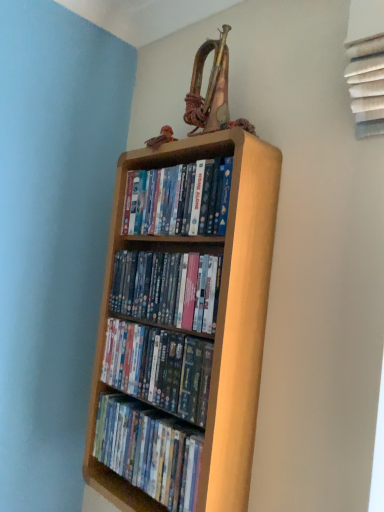
This screenshot has height=512, width=384. I want to click on wooden shelf at center, the 3th book positioned from the bottom, so click(x=167, y=288).

Considering the positions of points (203, 356) and (124, 300), is point (203, 356) closer to camera compared to point (124, 300)?

Yes, it is in front of point (124, 300).

Between matte plastic dvds at center, acting as the second book starting from the bottom, and wooden shelf at center, the 3th book positioned from the bottom, which one has more height?

matte plastic dvds at center, acting as the second book starting from the bottom.

Which of these two, matte plastic dvds at center, acting as the second book starting from the bottom, or wooden shelf at center, arranged as the second book when viewed from the top, is bigger?

matte plastic dvds at center, acting as the second book starting from the bottom.

From the image's perspective, is matte plastic dvds at center, positioned as the third book in top-to-bottom order, located above wooden shelf at center, arranged as the second book when viewed from the top?

No, from the image's perspective, matte plastic dvds at center, positioned as the third book in top-to-bottom order, is not above wooden shelf at center, arranged as the second book when viewed from the top.

Is light wood bookcase at center further to the viewer compared to wooden shelf at center, the 3th book positioned from the bottom?

No, light wood bookcase at center is closer to the camera.

From a real-world perspective, relative to wooden shelf at center, the 3th book positioned from the bottom, is light wood bookcase at center vertically above or below?

light wood bookcase at center is below wooden shelf at center, the 3th book positioned from the bottom.

From the picture: Which point is more forward, (215, 475) or (121, 300)?

The point (215, 475) is more forward.

Would you say light wood bookcase at center is inside or outside wooden shelf at center, arranged as the second book when viewed from the top?

The correct answer is: outside.

From the image's perspective, who appears lower, light wood bookcase at center or matte wooden shelf at upper center, the first book viewed from the top?

light wood bookcase at center is shown below in the image.

Is light wood bookcase at center positioned far away from matte wooden shelf at upper center, acting as the fourth book starting from the bottom?

light wood bookcase at center is actually quite close to matte wooden shelf at upper center, acting as the fourth book starting from the bottom.

From the picture: Is light wood bookcase at center in front of matte wooden shelf at upper center, the first book viewed from the top?

Yes, light wood bookcase at center is in front of matte wooden shelf at upper center, the first book viewed from the top.

From a real-world perspective, which object rests below the other?

light wood bookcase at center is physically lower.

Considering the sizes of objects matte wooden shelf at upper center, the first book viewed from the top, and wooden shelf at center, the 4th book in the top-to-bottom sequence, in the image provided, who is smaller, matte wooden shelf at upper center, the first book viewed from the top, or wooden shelf at center, the 4th book in the top-to-bottom sequence,?

Smaller between the two is matte wooden shelf at upper center, the first book viewed from the top.

Which object is further away from the camera, matte wooden shelf at upper center, the first book viewed from the top, or wooden shelf at center, the first book when ordered from bottom to top?

matte wooden shelf at upper center, the first book viewed from the top, is behind.

Is matte wooden shelf at upper center, the first book viewed from the top, next to wooden shelf at center, the first book when ordered from bottom to top?

matte wooden shelf at upper center, the first book viewed from the top, and wooden shelf at center, the first book when ordered from bottom to top, are clearly separated.

From the image's perspective, is matte plastic dvds at center, positioned as the third book in top-to-bottom order, below wooden shelf at center, the 4th book in the top-to-bottom sequence?

No.

Which of these two, matte plastic dvds at center, acting as the second book starting from the bottom, or wooden shelf at center, the 4th book in the top-to-bottom sequence, stands shorter?

Standing shorter between the two is matte plastic dvds at center, acting as the second book starting from the bottom.

Considering the positions of points (163, 351) and (200, 440), is point (163, 351) farther from camera compared to point (200, 440)?

Yes, point (163, 351) is behind point (200, 440).

Which object is wider, matte plastic dvds at center, acting as the second book starting from the bottom, or wooden shelf at center, the first book when ordered from bottom to top?

With larger width is matte plastic dvds at center, acting as the second book starting from the bottom.

Is matte wooden shelf at upper center, the first book viewed from the top, completely or partially outside of light wood bookcase at center?

Actually, matte wooden shelf at upper center, the first book viewed from the top, is at least partially inside light wood bookcase at center.

From the picture: Is matte wooden shelf at upper center, acting as the fourth book starting from the bottom, at the left side of light wood bookcase at center?

No.

Considering the points (150, 172) and (115, 205), which point is behind, point (150, 172) or point (115, 205)?

Positioned behind is point (115, 205).

Between matte wooden shelf at upper center, acting as the fourth book starting from the bottom, and light wood bookcase at center, which one is positioned in front?

light wood bookcase at center is more forward.

Which is in front, wooden shelf at center, the first book when ordered from bottom to top, or wooden shelf at center, arranged as the second book when viewed from the top?

wooden shelf at center, the first book when ordered from bottom to top, is closer to the camera.

Is wooden shelf at center, the first book when ordered from bottom to top, taller or shorter than wooden shelf at center, arranged as the second book when viewed from the top?

In the image, wooden shelf at center, the first book when ordered from bottom to top, appears to be taller than wooden shelf at center, arranged as the second book when viewed from the top.

Is wooden shelf at center, the 4th book in the top-to-bottom sequence, oriented away from wooden shelf at center, arranged as the second book when viewed from the top?

No, wooden shelf at center, the 4th book in the top-to-bottom sequence, is not facing the opposite direction of wooden shelf at center, arranged as the second book when viewed from the top.

Are wooden shelf at center, the first book when ordered from bottom to top, and wooden shelf at center, arranged as the second book when viewed from the top, located far from each other?

They are positioned close to each other.

At what (x,y) coordinates should I click in order to perform the action: click on book that is the 1st object located above the matte plastic dvds at center, acting as the second book starting from the bottom (from the image's perspective). Please return your answer as a coordinate pair (x, y). Looking at the image, I should click on (167, 288).

The width and height of the screenshot is (384, 512). Find the location of `bookcase on the left of wooden shelf at center, arranged as the second book when viewed from the top`. bookcase on the left of wooden shelf at center, arranged as the second book when viewed from the top is located at coordinates (183, 325).

Based on their spatial positions, is matte wooden shelf at upper center, the first book viewed from the top, or light wood bookcase at center further from matte plastic dvds at center, positioned as the third book in top-to-bottom order?

matte wooden shelf at upper center, the first book viewed from the top, is further to matte plastic dvds at center, positioned as the third book in top-to-bottom order.

From the image, which object appears to be farther from matte plastic dvds at center, positioned as the third book in top-to-bottom order, wooden shelf at center, the 3th book positioned from the bottom, or matte wooden shelf at upper center, the first book viewed from the top?

Among the two, matte wooden shelf at upper center, the first book viewed from the top, is located further to matte plastic dvds at center, positioned as the third book in top-to-bottom order.

When comparing their distances from wooden shelf at center, the first book when ordered from bottom to top, does wooden shelf at center, arranged as the second book when viewed from the top, or matte wooden shelf at upper center, acting as the fourth book starting from the bottom, seem further?

matte wooden shelf at upper center, acting as the fourth book starting from the bottom, is positioned further to the anchor wooden shelf at center, the first book when ordered from bottom to top.

Based on the photo, when comparing their distances from matte wooden shelf at upper center, acting as the fourth book starting from the bottom, does wooden shelf at center, the first book when ordered from bottom to top, or light wood bookcase at center seem closer?

light wood bookcase at center.

When comparing their distances from matte plastic dvds at center, positioned as the third book in top-to-bottom order, does matte wooden shelf at upper center, the first book viewed from the top, or wooden shelf at center, the 4th book in the top-to-bottom sequence, seem further?

matte wooden shelf at upper center, the first book viewed from the top, is further to matte plastic dvds at center, positioned as the third book in top-to-bottom order.

Looking at the image, which one is located closer to wooden shelf at center, arranged as the second book when viewed from the top, matte wooden shelf at upper center, the first book viewed from the top, or matte plastic dvds at center, positioned as the third book in top-to-bottom order?

Among the two, matte plastic dvds at center, positioned as the third book in top-to-bottom order, is located nearer to wooden shelf at center, arranged as the second book when viewed from the top.

Considering their positions, is matte plastic dvds at center, acting as the second book starting from the bottom, positioned further to wooden shelf at center, arranged as the second book when viewed from the top, than light wood bookcase at center?

light wood bookcase at center is further to wooden shelf at center, arranged as the second book when viewed from the top.

Which object lies nearer to the anchor point wooden shelf at center, the first book when ordered from bottom to top, light wood bookcase at center or matte wooden shelf at upper center, acting as the fourth book starting from the bottom?

light wood bookcase at center lies closer to wooden shelf at center, the first book when ordered from bottom to top, than the other object.

Locate an element on the screen. The height and width of the screenshot is (512, 384). book between matte wooden shelf at upper center, acting as the fourth book starting from the bottom, and light wood bookcase at center vertically is located at coordinates (167, 288).

Find the location of a particular element. This screenshot has width=384, height=512. bookcase between wooden shelf at center, arranged as the second book when viewed from the top, and wooden shelf at center, the 4th book in the top-to-bottom sequence, in the vertical direction is located at coordinates (183, 325).

Where is `bookcase between wooden shelf at center, arranged as the second book when viewed from the top, and matte plastic dvds at center, acting as the second book starting from the bottom, from top to bottom`? The height and width of the screenshot is (512, 384). bookcase between wooden shelf at center, arranged as the second book when viewed from the top, and matte plastic dvds at center, acting as the second book starting from the bottom, from top to bottom is located at coordinates (183, 325).

Image resolution: width=384 pixels, height=512 pixels. In order to click on book between light wood bookcase at center and wooden shelf at center, the first book when ordered from bottom to top, in the vertical direction in this screenshot , I will do `click(159, 368)`.